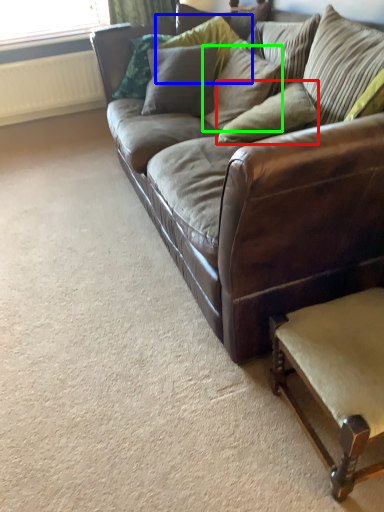
Question: Considering the real-world distances, which object is closest to pillow (highlighted by a red box)? pillow (highlighted by a blue box) or pillow (highlighted by a green box).

Choices:
 (A) pillow
 (B) pillow

Answer: (B)